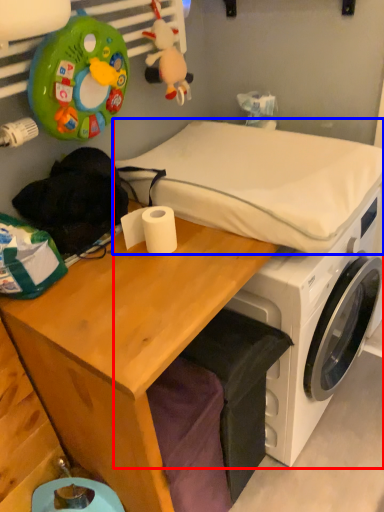
Question: Which object is closer to the camera taking this photo, machine (highlighted by a red box) or mattress (highlighted by a blue box)?

Choices:
 (A) machine
 (B) mattress

Answer: (B)